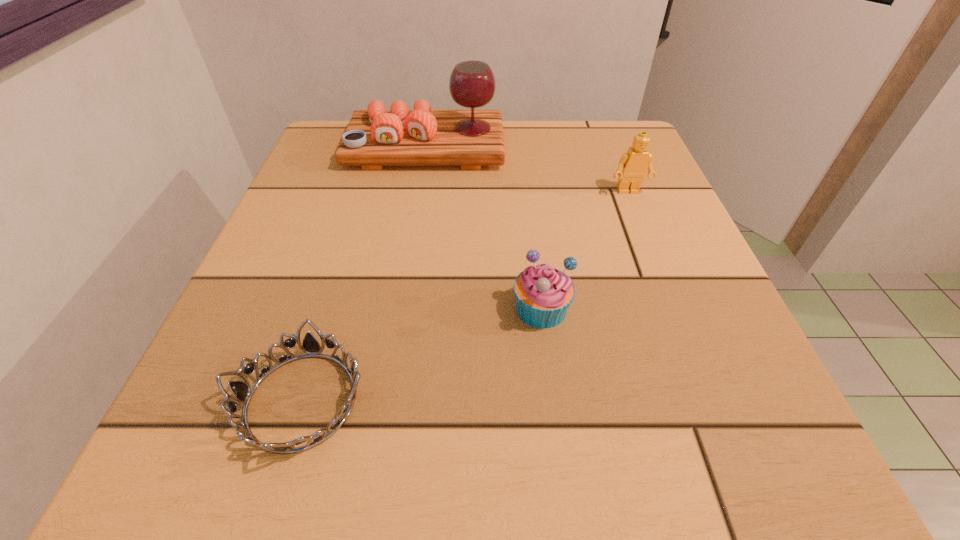
You are a GUI agent. You are given a task and a screenshot of the screen. Output one action in this format:
    pyautogui.click(x=<x>, y=<y>)
    Task: Click on the free spot that satisfies the following two spatial constraints: 1. on the front side of the muffin; 2. on the front-facing side of the nearest object
    This screenshot has height=540, width=960.
    Given the screenshot: What is the action you would take?
    pyautogui.click(x=553, y=401)

You are a GUI agent. You are given a task and a screenshot of the screen. Output one action in this format:
    pyautogui.click(x=<x>, y=<y>)
    Task: Click on the vacant space that satisfies the following two spatial constraints: 1. on the front side of the muffin; 2. on the front-facing side of the tiara
    
    Given the screenshot: What is the action you would take?
    pyautogui.click(x=553, y=401)